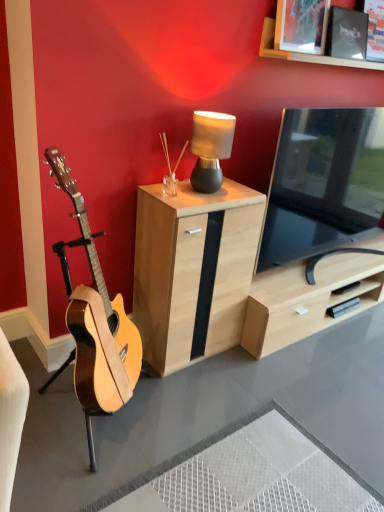
At what (x,y) coordinates should I click in order to perform the action: click on vacant area that lies in front of light wood cabinet at center. Please return your answer as a coordinate pair (x, y). The image size is (384, 512). Looking at the image, I should click on (218, 395).